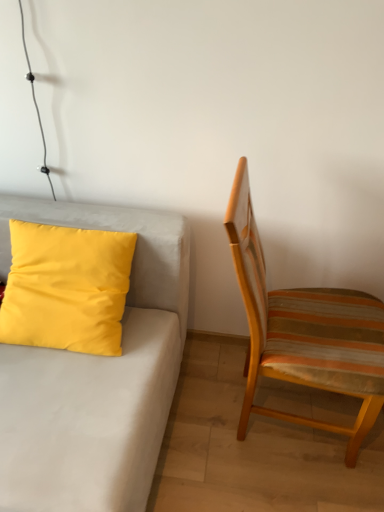
I want to click on matte yellow pillow at upper left, so click(95, 375).

The height and width of the screenshot is (512, 384). Describe the element at coordinates (66, 288) in the screenshot. I see `yellow matte pillow at left` at that location.

Locate an element on the screen. This screenshot has width=384, height=512. matte yellow pillow at upper left is located at coordinates click(x=95, y=375).

Is yellow matte pillow at left positioned with its back to matte yellow pillow at upper left?

Yes, yellow matte pillow at left is facing away from matte yellow pillow at upper left.

From a real-world perspective, is yellow matte pillow at left physically above matte yellow pillow at upper left?

Correct, in the physical world, yellow matte pillow at left is higher than matte yellow pillow at upper left.

Which point is more forward, (84, 291) or (60, 208)?

Positioned in front is point (84, 291).

Which object is wider, yellow matte pillow at left or matte yellow pillow at upper left?

With larger width is matte yellow pillow at upper left.

Is matte yellow pillow at upper left facing towards yellow matte pillow at left?

No.

In the scene shown: Is matte yellow pillow at upper left inside or outside of yellow matte pillow at left?

matte yellow pillow at upper left is not enclosed by yellow matte pillow at left.

In the image, there is a yellow matte pillow at left. Where is `studio couch below it (from a real-world perspective)`? studio couch below it (from a real-world perspective) is located at coordinates (95, 375).

From the picture: Is matte yellow pillow at upper left not close to yellow matte pillow at left?

Actually, matte yellow pillow at upper left and yellow matte pillow at left are a little close together.

Is point (233, 220) closer to viewer compared to point (98, 241)?

Yes, it is.

Looking at this image, between striped fabric chair at right and yellow matte pillow at left, which one appears on the left side from the viewer's perspective?

Positioned to the left is yellow matte pillow at left.

Considering the relative sizes of striped fabric chair at right and yellow matte pillow at left in the image provided, is striped fabric chair at right smaller than yellow matte pillow at left?

Incorrect, striped fabric chair at right is not smaller in size than yellow matte pillow at left.

Is yellow matte pillow at left at the back of striped fabric chair at right?

That's right, striped fabric chair at right is facing away from yellow matte pillow at left.

Is yellow matte pillow at left situated inside striped fabric chair at right or outside?

yellow matte pillow at left is not inside striped fabric chair at right, it's outside.

Between yellow matte pillow at left and striped fabric chair at right, which one has more height?

With more height is striped fabric chair at right.

At what (x,y) coordinates should I click in order to perform the action: click on pillow above the striped fabric chair at right (from the image's perspective). Please return your answer as a coordinate pair (x, y). Image resolution: width=384 pixels, height=512 pixels. Looking at the image, I should click on (66, 288).

Is yellow matte pillow at left oriented away from striped fabric chair at right?

No.

Considering the relative sizes of striped fabric chair at right and matte yellow pillow at upper left in the image provided, is striped fabric chair at right taller than matte yellow pillow at upper left?

Yes, striped fabric chair at right is taller than matte yellow pillow at upper left.

From the image's perspective, is striped fabric chair at right above matte yellow pillow at upper left?

Yes, from the image's perspective, striped fabric chair at right is on top of matte yellow pillow at upper left.

Which object is positioned more to the left, striped fabric chair at right or matte yellow pillow at upper left?

From the viewer's perspective, matte yellow pillow at upper left appears more on the left side.

How distant is matte yellow pillow at upper left from striped fabric chair at right?

They are 49.04 centimeters apart.

Is matte yellow pillow at upper left looking in the opposite direction of striped fabric chair at right?

No, matte yellow pillow at upper left is not facing away from striped fabric chair at right.

Does matte yellow pillow at upper left come in front of striped fabric chair at right?

That is True.

Locate an element on the screen. The image size is (384, 512). pillow lying on the right of matte yellow pillow at upper left is located at coordinates (66, 288).

At what (x,y) coordinates should I click in order to perform the action: click on pillow that appears above the matte yellow pillow at upper left (from the image's perspective). Please return your answer as a coordinate pair (x, y). Looking at the image, I should click on (66, 288).

Based on their spatial positions, is matte yellow pillow at upper left or yellow matte pillow at left closer to striped fabric chair at right?

matte yellow pillow at upper left.

From the image, which object appears to be nearer to matte yellow pillow at upper left, yellow matte pillow at left or striped fabric chair at right?

The object closer to matte yellow pillow at upper left is yellow matte pillow at left.

Looking at the image, which one is located further to yellow matte pillow at left, striped fabric chair at right or matte yellow pillow at upper left?

striped fabric chair at right lies further to yellow matte pillow at left than the other object.

Which object lies further to the anchor point yellow matte pillow at left, matte yellow pillow at upper left or striped fabric chair at right?

striped fabric chair at right.

From the image, which object appears to be nearer to striped fabric chair at right, yellow matte pillow at left or matte yellow pillow at upper left?

Based on the image, matte yellow pillow at upper left appears to be nearer to striped fabric chair at right.

Estimate the real-world distances between objects in this image. Which object is further from matte yellow pillow at upper left, striped fabric chair at right or yellow matte pillow at left?

The object further to matte yellow pillow at upper left is striped fabric chair at right.

Identify the location of pillow between matte yellow pillow at upper left and striped fabric chair at right. (66, 288).